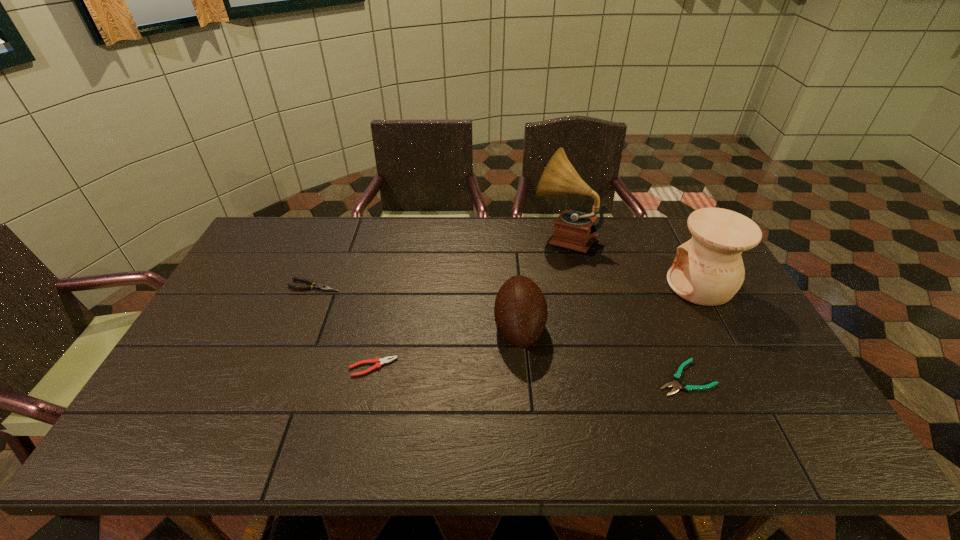
At what (x,y) coordinates should I click in order to perform the action: click on free space located 0.090m on the horn of the tallest object. Please return your answer as a coordinate pair (x, y). The image size is (960, 540). Looking at the image, I should click on (506, 237).

Where is `free space located on the horn of the tallest object`? This screenshot has width=960, height=540. free space located on the horn of the tallest object is located at coordinates (477, 237).

Where is `vacant area located 0.230m on the horn of the tallest object`? vacant area located 0.230m on the horn of the tallest object is located at coordinates (467, 237).

At what (x,y) coordinates should I click in order to perform the action: click on vacant space situated 0.260m at the open side of the fifth shortest object. Please return your answer as a coordinate pair (x, y). The width and height of the screenshot is (960, 540). Looking at the image, I should click on (585, 285).

At what (x,y) coordinates should I click in order to perform the action: click on blank space located at the open side of the fifth shortest object. Please return your answer as a coordinate pair (x, y). Looking at the image, I should click on (613, 285).

Find the location of a particular element. The width and height of the screenshot is (960, 540). free space located 0.130m at the open side of the fifth shortest object is located at coordinates (626, 285).

Locate an element on the screen. vacant space located 0.350m on the laces of the fourth shortest object is located at coordinates (371, 328).

Where is `vacant space located on the laces of the fourth shortest object`? vacant space located on the laces of the fourth shortest object is located at coordinates (406, 328).

In order to click on blank space located on the laces of the fourth shortest object in this screenshot , I will do `click(466, 328)`.

The image size is (960, 540). Identify the location of vacant point located on the back of the leftmost pliers. (331, 245).